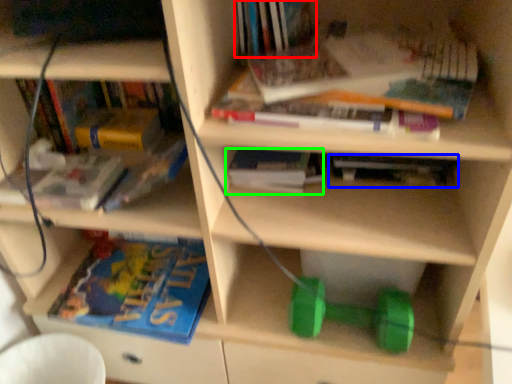
Question: Estimate the real-world distances between objects in this image. Which object is closer to book (highlighted by a red box), book (highlighted by a blue box) or book (highlighted by a green box)?

Choices:
 (A) book
 (B) book

Answer: (B)